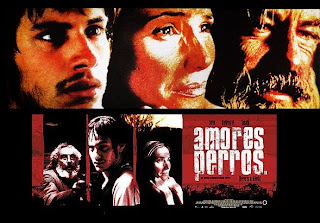
This screenshot has width=320, height=223. Identify the location of movie poster. (40, 51).